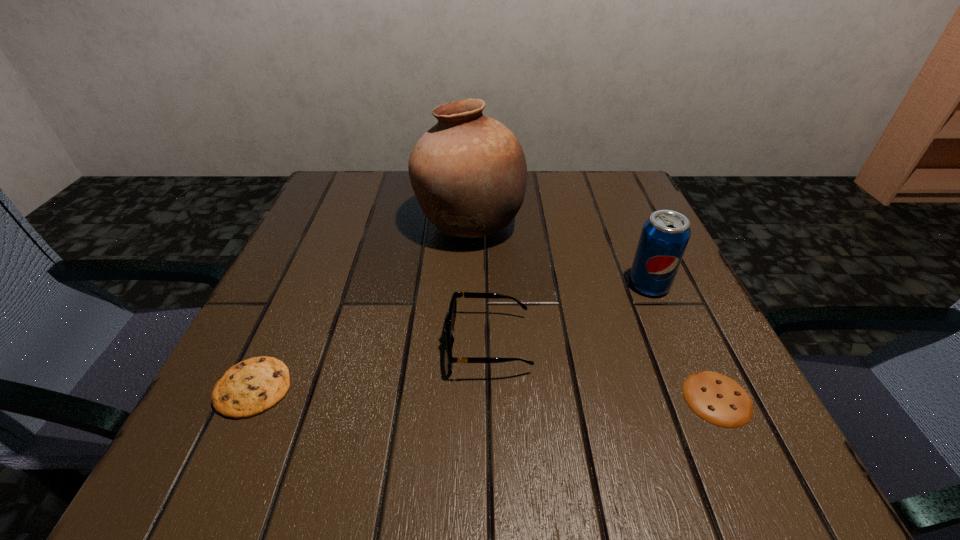
I want to click on the tallest object, so click(x=468, y=172).

In order to click on the farthest object in this screenshot , I will do `click(468, 172)`.

This screenshot has width=960, height=540. I want to click on the fourth shortest object, so click(x=665, y=235).

The image size is (960, 540). Find the location of `pop soda`. pop soda is located at coordinates (665, 235).

At what (x,y) coordinates should I click in order to perform the action: click on sunglasses. Please return your answer as a coordinate pair (x, y). The image size is (960, 540). Looking at the image, I should click on (451, 316).

Where is `the second shortest object`? Image resolution: width=960 pixels, height=540 pixels. the second shortest object is located at coordinates (249, 388).

Locate an element on the screen. the left cookie is located at coordinates coord(249,388).

You are a GUI agent. You are given a task and a screenshot of the screen. Output one action in this format:
    pyautogui.click(x=<x>, y=<y>)
    Task: Click on the right cookie
    
    Given the screenshot: What is the action you would take?
    pyautogui.click(x=718, y=399)

The height and width of the screenshot is (540, 960). I want to click on the shorter cookie, so click(718, 399).

Identify the location of free space located 0.130m on the front of the pottery. This screenshot has width=960, height=540. (467, 302).